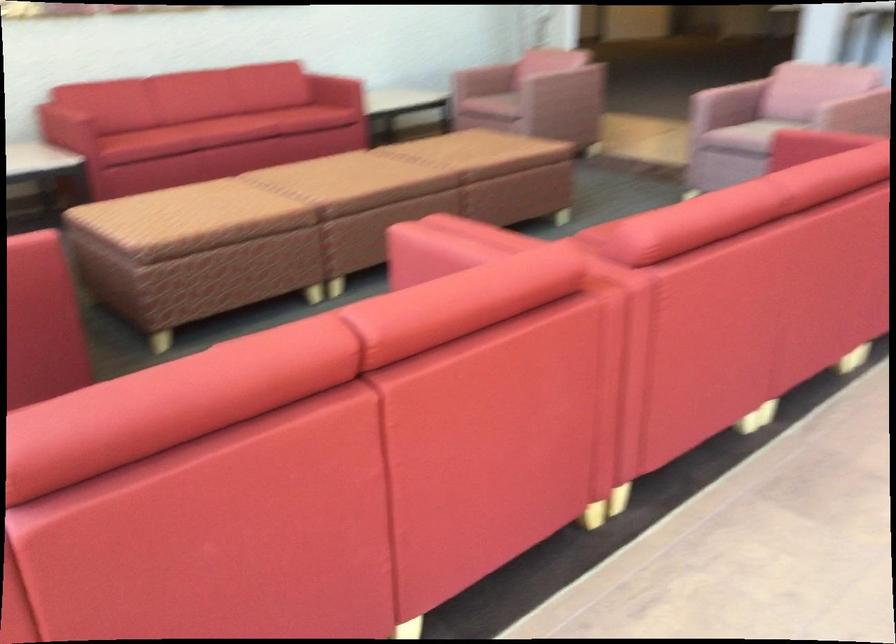
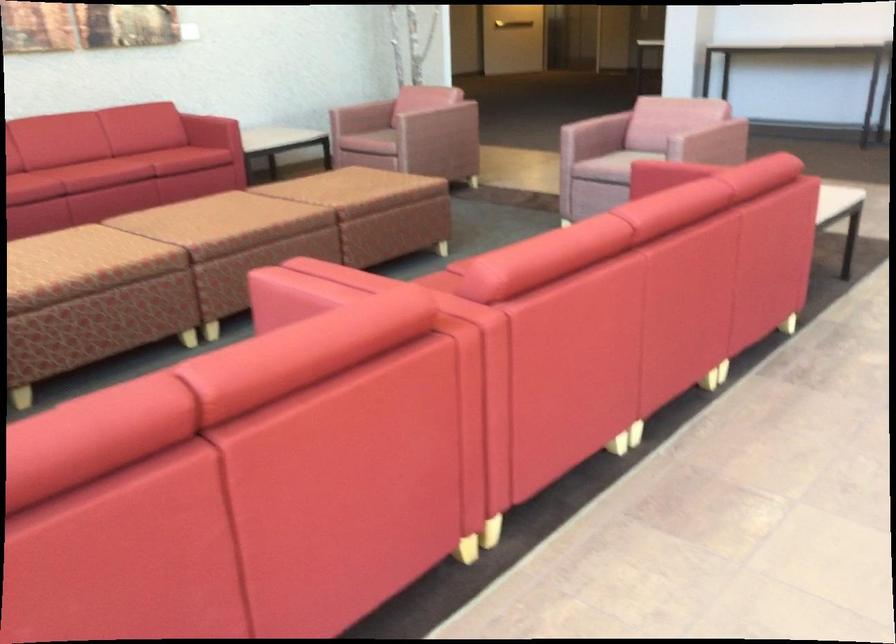
Find the pixel in the second image that matches pixel 280 503 in the first image.

(112, 574)